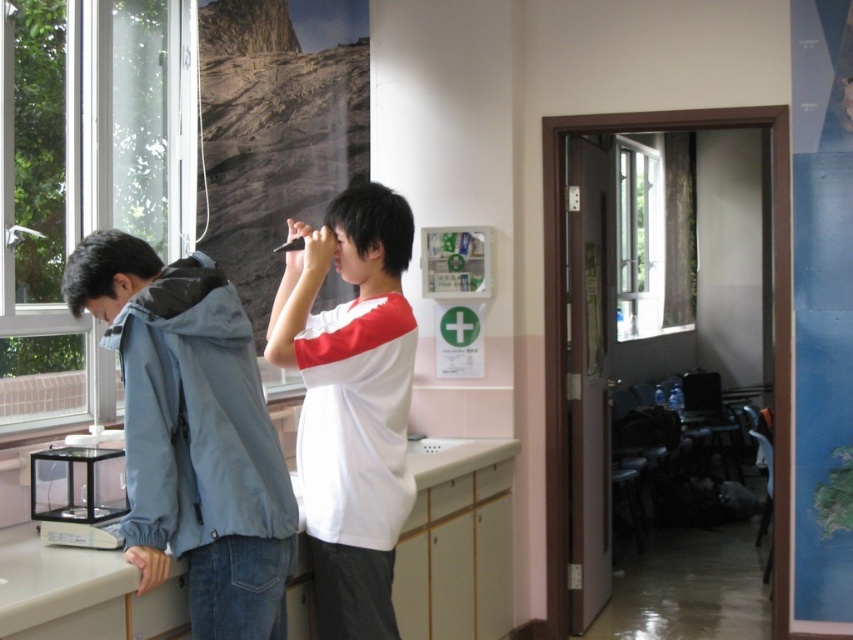
What do you see at coordinates (85, 179) in the screenshot?
I see `transparent glass window at left` at bounding box center [85, 179].

Who is taller, transparent glass window at left or light blue fabric jacket at left?

With more height is transparent glass window at left.

The width and height of the screenshot is (853, 640). What do you see at coordinates (85, 179) in the screenshot? I see `transparent glass window at left` at bounding box center [85, 179].

I want to click on transparent glass window at left, so click(85, 179).

How far apart are white matte shirt at center and white glossy countertop at lower center?

1.09 meters

Is point (387, 387) positioned before point (402, 596)?

Yes, it is.

What do you see at coordinates (351, 403) in the screenshot? I see `white matte shirt at center` at bounding box center [351, 403].

The image size is (853, 640). I want to click on white matte shirt at center, so click(351, 403).

Based on the photo, does transparent glass window at left have a lesser width compared to white matte shirt at center?

Incorrect, transparent glass window at left's width is not less than white matte shirt at center's.

Which is below, transparent glass window at left or white matte shirt at center?

Positioned lower is white matte shirt at center.

The image size is (853, 640). Identify the location of transparent glass window at left. (85, 179).